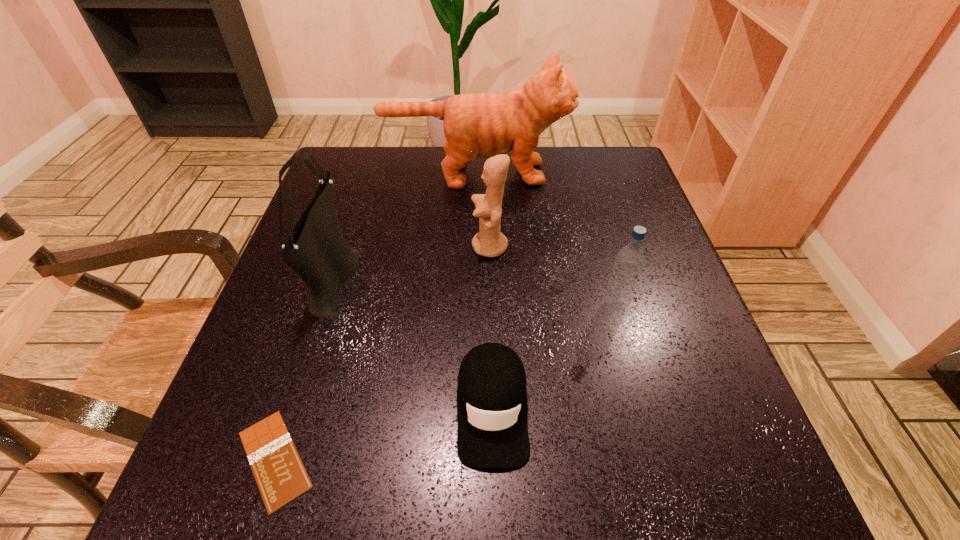
Where is `object that is at the right edge`? This screenshot has height=540, width=960. object that is at the right edge is located at coordinates (629, 261).

Locate an element on the screen. Image resolution: width=960 pixels, height=540 pixels. object that is at the far left corner is located at coordinates (483, 125).

At what (x,y) coordinates should I click in order to perform the action: click on object located in the near left corner section of the desktop. Please return your answer as a coordinate pair (x, y). Looking at the image, I should click on (281, 477).

Locate an element on the screen. The height and width of the screenshot is (540, 960). free space at the far edge of the desktop is located at coordinates (558, 173).

Locate an element on the screen. This screenshot has height=540, width=960. vacant space at the near edge of the desktop is located at coordinates (341, 484).

In the image, there is a desktop. Identify the location of blank space at the right edge. The image size is (960, 540). (642, 246).

Where is `vacant space at the far left corner of the desktop`? This screenshot has height=540, width=960. vacant space at the far left corner of the desktop is located at coordinates [x=385, y=151].

Find the location of a particular element. Image resolution: width=960 pixels, height=540 pixels. vacant space at the far right corner of the desktop is located at coordinates (604, 179).

In order to click on free region at the near right corner of the desktop in this screenshot , I will do `click(732, 498)`.

Find the location of a particular element. This screenshot has width=960, height=540. vacant space in between the shortest object and the figurine is located at coordinates (382, 353).